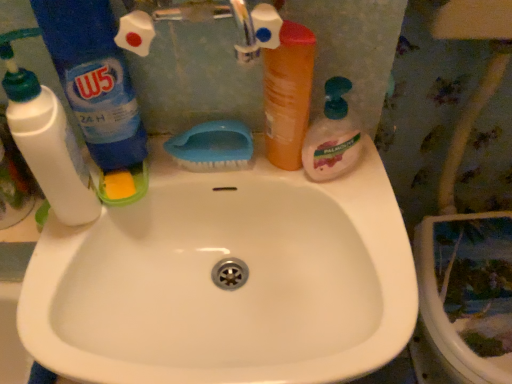
Question: Is orange matte bottle at upper center shorter than translucent plastic soap dispenser at right, acting as the first cleaning product starting from the right?

Choices:
 (A) no
 (B) yes

Answer: (A)

Question: Does orange matte bottle at upper center have a greater height compared to translucent plastic soap dispenser at right, acting as the first cleaning product starting from the right?

Choices:
 (A) yes
 (B) no

Answer: (A)

Question: Is orange matte bottle at upper center to the left of translucent plastic soap dispenser at right, which ranks as the third cleaning product in left-to-right order, from the viewer's perspective?

Choices:
 (A) no
 (B) yes

Answer: (B)

Question: Does orange matte bottle at upper center lie in front of translucent plastic soap dispenser at right, acting as the first cleaning product starting from the right?

Choices:
 (A) yes
 (B) no

Answer: (A)

Question: Is orange matte bottle at upper center behind translucent plastic soap dispenser at right, acting as the first cleaning product starting from the right?

Choices:
 (A) no
 (B) yes

Answer: (A)

Question: Is orange matte bottle at upper center aimed at translucent plastic soap dispenser at right, acting as the first cleaning product starting from the right?

Choices:
 (A) no
 (B) yes

Answer: (A)

Question: Is blue plastic brush at upper center looking in the opposite direction of blue plastic bottle at left, the second cleaning product positioned from the left?

Choices:
 (A) yes
 (B) no

Answer: (B)

Question: Is blue plastic brush at upper center at the left side of blue plastic bottle at left, the second cleaning product positioned from the left?

Choices:
 (A) yes
 (B) no

Answer: (B)

Question: Is blue plastic brush at upper center with blue plastic bottle at left, the second cleaning product positioned from the left?

Choices:
 (A) yes
 (B) no

Answer: (B)

Question: Does blue plastic brush at upper center have a greater width compared to blue plastic bottle at left, the second cleaning product positioned from the left?

Choices:
 (A) no
 (B) yes

Answer: (A)

Question: Can you confirm if blue plastic brush at upper center is thinner than blue plastic bottle at left, which is counted as the second cleaning product, starting from the right?

Choices:
 (A) yes
 (B) no

Answer: (A)

Question: From a real-world perspective, is blue plastic brush at upper center under blue plastic bottle at left, the second cleaning product positioned from the left?

Choices:
 (A) yes
 (B) no

Answer: (A)

Question: Considering the relative sizes of blue plastic bottle at left, which is counted as the second cleaning product, starting from the right, and translucent plastic soap dispenser at right, which ranks as the third cleaning product in left-to-right order, in the image provided, is blue plastic bottle at left, which is counted as the second cleaning product, starting from the right, wider than translucent plastic soap dispenser at right, which ranks as the third cleaning product in left-to-right order,?

Choices:
 (A) yes
 (B) no

Answer: (A)